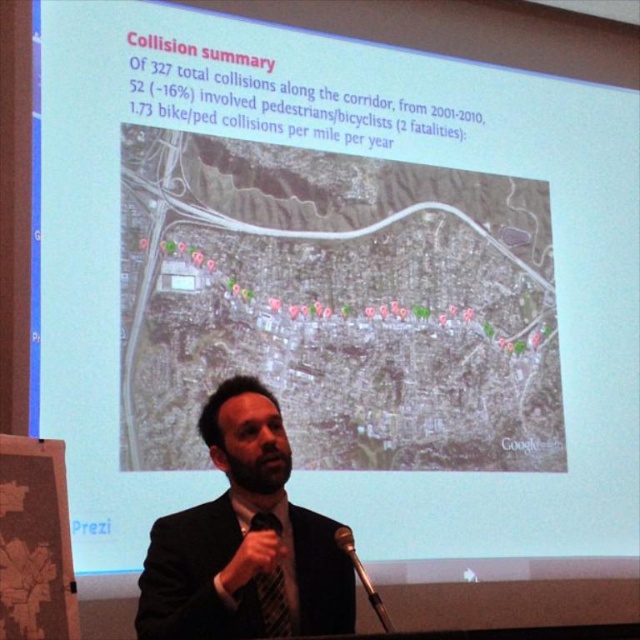
What object is located at the coordinates point [243,538]?

The black suit at center is located at point [243,538].

You are a photographer standing to the side of the presentation. You want to take a photo of the presenter so that both the black suit at center and the black satin tie at lower center are clearly visible. Do you need to adjust your camera angle to ensure both are in frame?

The black suit at center might be wider than black satin tie at lower center, so you may need to adjust your camera angle to ensure both are in frame depending on their actual widths.